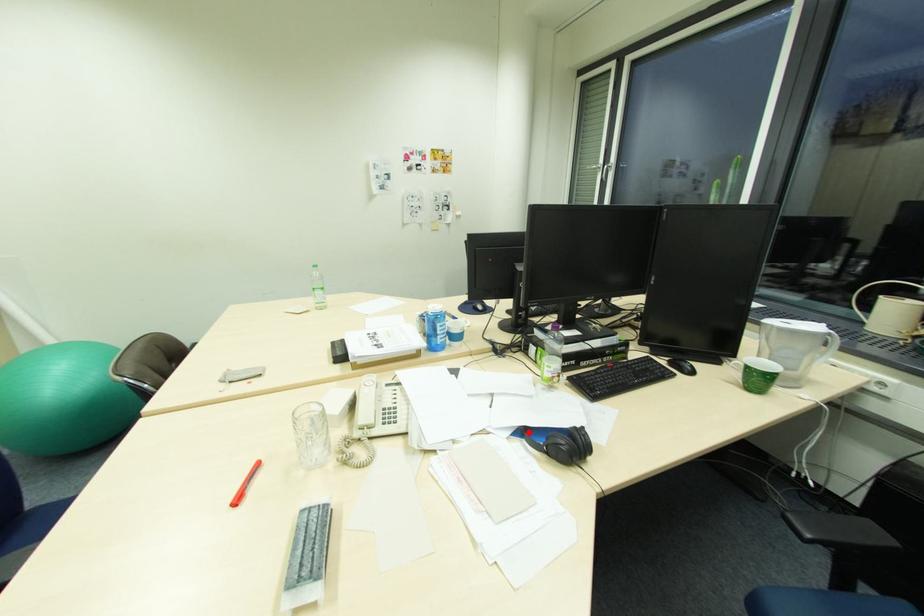
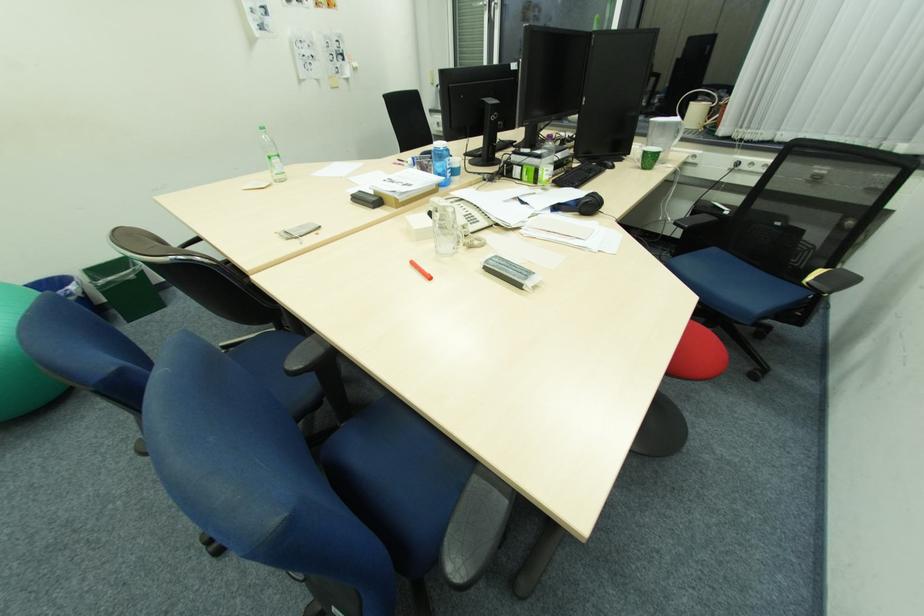
Question: I am providing you with two images of the same scene from different viewpoints. A red point is marked on the first image. Can you still see the location of the red point in image 2?

Choices:
 (A) Yes
 (B) No

Answer: (A)